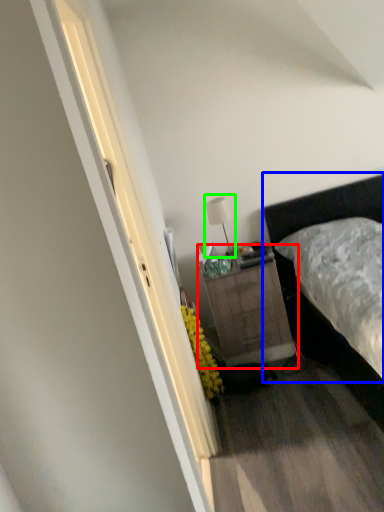
Question: Which is farther away from nightstand (highlighted by a red box)? bed (highlighted by a blue box) or table lamp (highlighted by a green box)?

Choices:
 (A) bed
 (B) table lamp

Answer: (B)